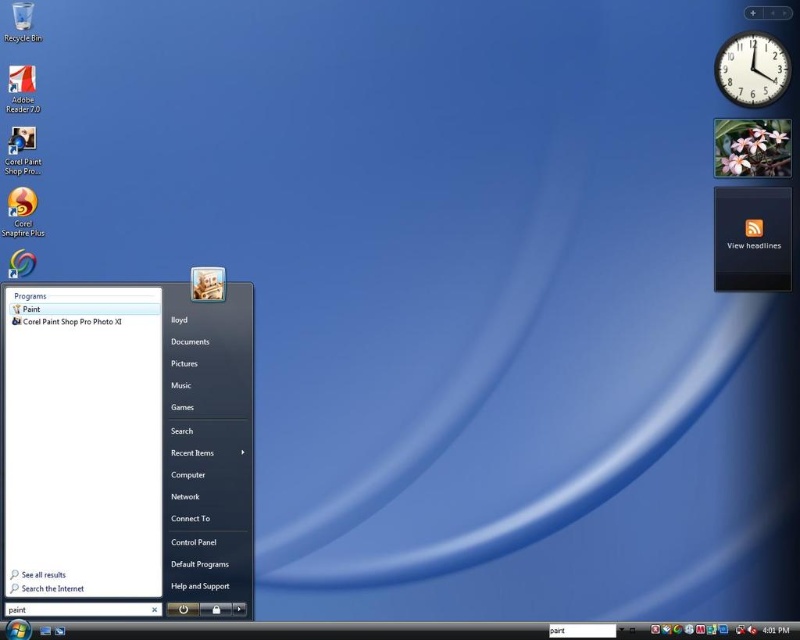
Question: Does white matte menu at center have a larger size compared to black plastic clock at upper right?

Choices:
 (A) no
 (B) yes

Answer: (B)

Question: Does white matte menu at center have a greater width compared to black plastic clock at upper right?

Choices:
 (A) no
 (B) yes

Answer: (B)

Question: Does white matte menu at center appear on the left side of black plastic clock at upper right?

Choices:
 (A) yes
 (B) no

Answer: (A)